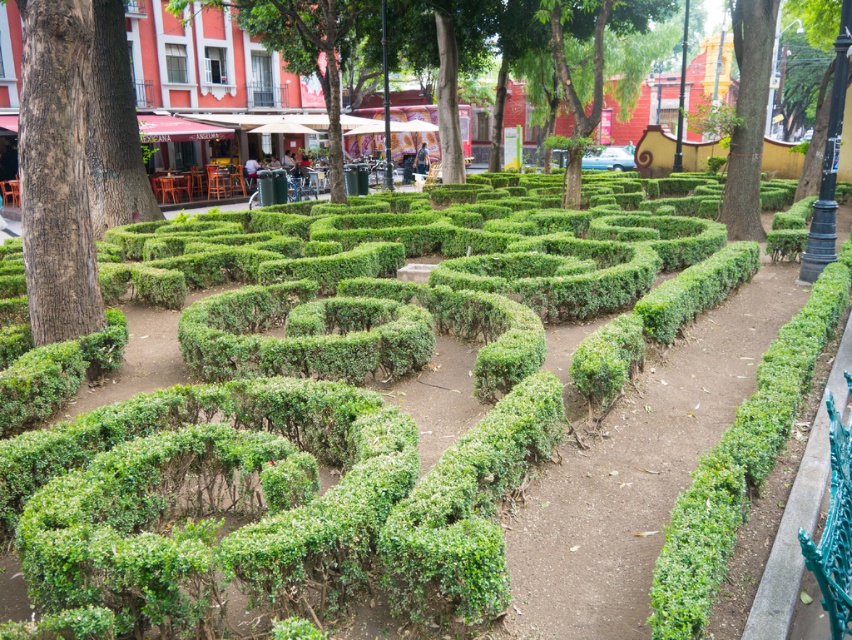
Question: Is brown textured tree trunk at left bigger than green leafy tree at upper center?

Choices:
 (A) no
 (B) yes

Answer: (A)

Question: Which object appears closest to the camera in this image?

Choices:
 (A) brown textured tree trunk at left
 (B) green leafy tree at upper right

Answer: (A)

Question: Observing the image, what is the correct spatial positioning of brown textured tree trunk at left in reference to green leafy tree at upper center?

Choices:
 (A) right
 (B) left

Answer: (B)

Question: Does green leafy tree at upper center have a greater width compared to green leafy tree at upper right?

Choices:
 (A) no
 (B) yes

Answer: (B)

Question: Which point is closer to the camera taking this photo?

Choices:
 (A) (743, 156)
 (B) (70, 120)
 (C) (619, 106)

Answer: (B)

Question: Which object is positioned farthest from the brown textured tree trunk at left?

Choices:
 (A) green leafy tree at upper center
 (B) green leafy tree at upper right

Answer: (A)